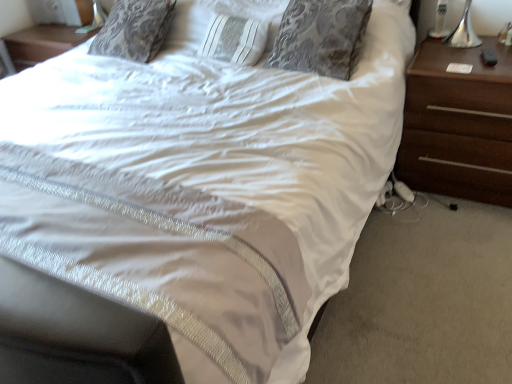
Identify the location of free spot above brown wood nightstand at right (from a real-world perspective). The image size is (512, 384). [x=466, y=55].